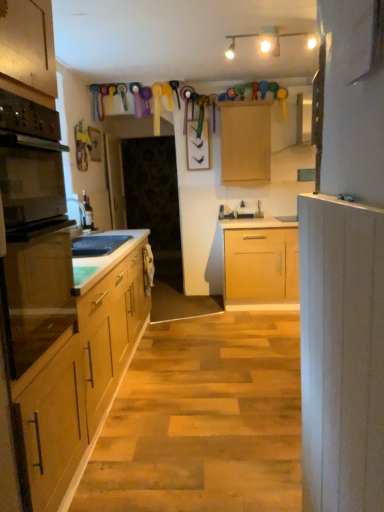
Question: Can you confirm if white painted wood cabinet at right, placed as the first cabinetry when sorted from bottom to top, is bigger than white frosted glass light fixture at upper center?

Choices:
 (A) no
 (B) yes

Answer: (B)

Question: From a real-world perspective, is white painted wood cabinet at right, which is counted as the 1th cabinetry, starting from the front, physically below white frosted glass light fixture at upper center?

Choices:
 (A) no
 (B) yes

Answer: (B)

Question: Is white painted wood cabinet at right, placed as the first cabinetry when sorted from bottom to top, oriented towards white frosted glass light fixture at upper center?

Choices:
 (A) yes
 (B) no

Answer: (A)

Question: Is white painted wood cabinet at right, acting as the 2th cabinetry starting from the back, shorter than white frosted glass light fixture at upper center?

Choices:
 (A) yes
 (B) no

Answer: (B)

Question: From a real-world perspective, does white painted wood cabinet at right, which appears as the 2th cabinetry when viewed from the top, stand above white frosted glass light fixture at upper center?

Choices:
 (A) no
 (B) yes

Answer: (A)

Question: From the image's perspective, is white frosted glass light fixture at upper center positioned above or below black matte sink at left?

Choices:
 (A) below
 (B) above

Answer: (B)

Question: Is point (304, 34) closer or farther from the camera than point (96, 251)?

Choices:
 (A) closer
 (B) farther

Answer: (B)

Question: Relative to black matte sink at left, is white frosted glass light fixture at upper center in front or behind?

Choices:
 (A) behind
 (B) front

Answer: (B)

Question: From their relative heights in the image, would you say white frosted glass light fixture at upper center is taller or shorter than black matte sink at left?

Choices:
 (A) short
 (B) tall

Answer: (B)

Question: In terms of height, does white painted wood cabinet at right, which appears as the 2th cabinetry when viewed from the top, look taller or shorter compared to black matte sink at left?

Choices:
 (A) tall
 (B) short

Answer: (A)

Question: Relative to black matte sink at left, is white painted wood cabinet at right, placed as the first cabinetry when sorted from bottom to top, in front or behind?

Choices:
 (A) front
 (B) behind

Answer: (A)

Question: Considering the positions of white painted wood cabinet at right, which is counted as the 1th cabinetry, starting from the front, and black matte sink at left in the image, is white painted wood cabinet at right, which is counted as the 1th cabinetry, starting from the front, wider or thinner than black matte sink at left?

Choices:
 (A) wide
 (B) thin

Answer: (A)

Question: In terms of size, does white painted wood cabinet at right, which is counted as the 1th cabinetry, starting from the front, appear bigger or smaller than black matte sink at left?

Choices:
 (A) big
 (B) small

Answer: (A)

Question: Based on their positions, is white frosted glass light fixture at upper center located to the left or right of black glass oven at left?

Choices:
 (A) right
 (B) left

Answer: (A)

Question: Relative to black glass oven at left, is white frosted glass light fixture at upper center in front or behind?

Choices:
 (A) behind
 (B) front

Answer: (A)